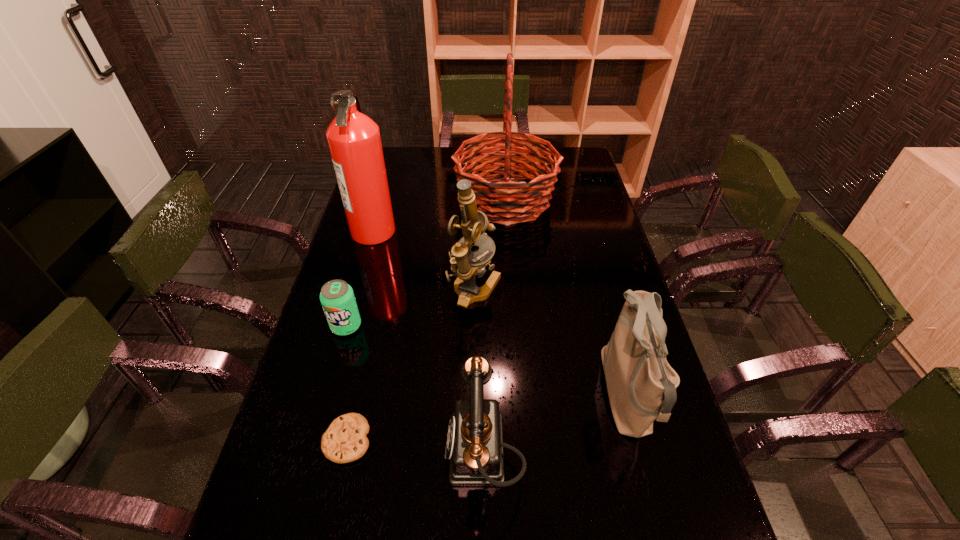
Image resolution: width=960 pixels, height=540 pixels. What are the coordinates of `vacant space that satisfies the following two spatial constraints: 1. on the back side of the microscope; 2. at the nozzle of the fire extinguisher` in the screenshot? It's located at (474, 231).

You are a GUI agent. You are given a task and a screenshot of the screen. Output one action in this format:
    pyautogui.click(x=<x>, y=<y>)
    Task: Click on the vacant region that satisfies the following two spatial constraints: 1. on the front side of the basket; 2. on the front of the telephone at the rotary dial
    The height and width of the screenshot is (540, 960).
    Given the screenshot: What is the action you would take?
    pyautogui.click(x=523, y=453)